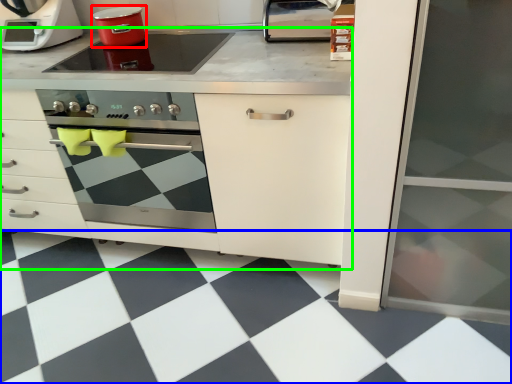
Question: Based on their relative distances, which object is nearer to kitchen appliance (highlighted by a red box)? Choose from tile (highlighted by a blue box) and cabinetry (highlighted by a green box).

Choices:
 (A) tile
 (B) cabinetry

Answer: (B)